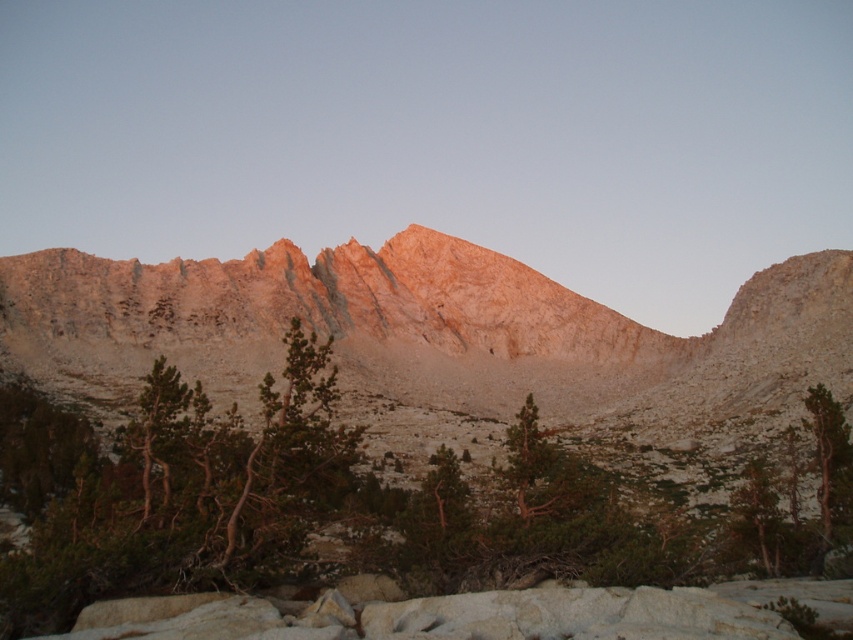
Who is shorter, green textured tree at center or green textured tree at right?

With less height is green textured tree at right.

Is green textured tree at center positioned behind green textured tree at right?

No, green textured tree at center is closer to the viewer.

Is point (221, 564) farther from viewer compared to point (827, 522)?

That is False.

In order to click on green textured tree at center in this screenshot , I will do `click(325, 502)`.